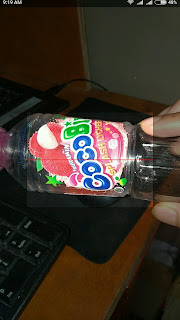
Find the location of a particular element. The width and height of the screenshot is (180, 320). keyboard is located at coordinates (35, 280).